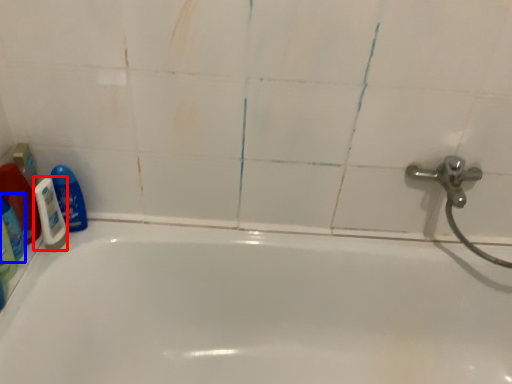
Question: Which point is further to the camera, shaving cream (highlighted by a red box) or cleaning product (highlighted by a blue box)?

Choices:
 (A) shaving cream
 (B) cleaning product

Answer: (A)